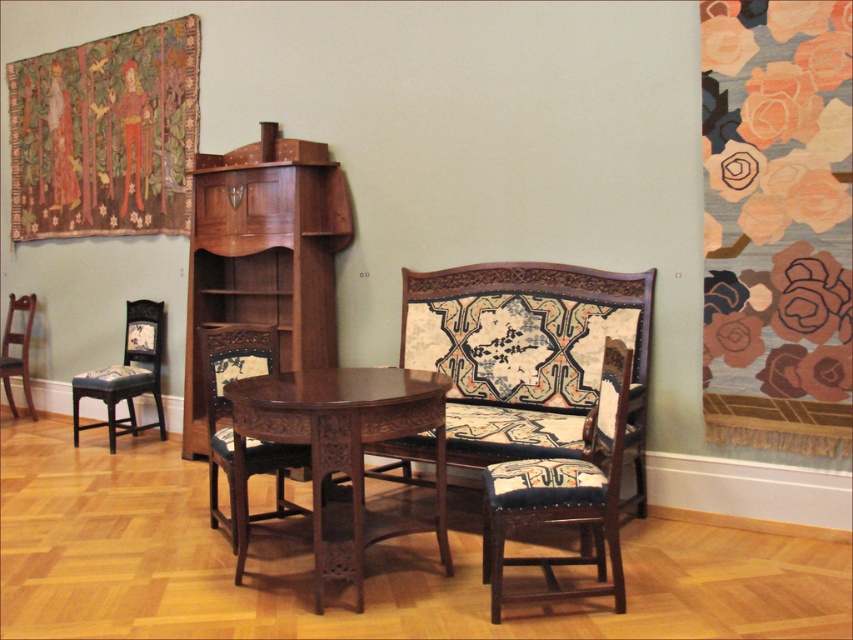
Question: Considering the real-world distances, which object is farthest from the dark blue fabric armchair at center?

Choices:
 (A) mahogany wood table at center
 (B) mahogany wood bookshelf at center
 (C) floral-patterned fabric at right

Answer: (B)

Question: Can you confirm if mahogany wood bookshelf at center is positioned to the right of matte dark wood armchair at left?

Choices:
 (A) no
 (B) yes

Answer: (B)

Question: Is mahogany wood bookshelf at center wider than matte dark wood armchair at left?

Choices:
 (A) yes
 (B) no

Answer: (A)

Question: Among these objects, which one is nearest to the camera?

Choices:
 (A) mahogany wood bookshelf at center
 (B) matte dark wood armchair at left
 (C) mahogany wood table at center
 (D) dark blue fabric armchair at center

Answer: (D)

Question: Which point is farther to the camera?

Choices:
 (A) (614, 480)
 (B) (834, 8)
 (C) (358, 611)
 (D) (306, 280)

Answer: (D)

Question: Does richly colored fabric tapestry at upper left have a larger size compared to carved wood armchair at center?

Choices:
 (A) yes
 (B) no

Answer: (A)